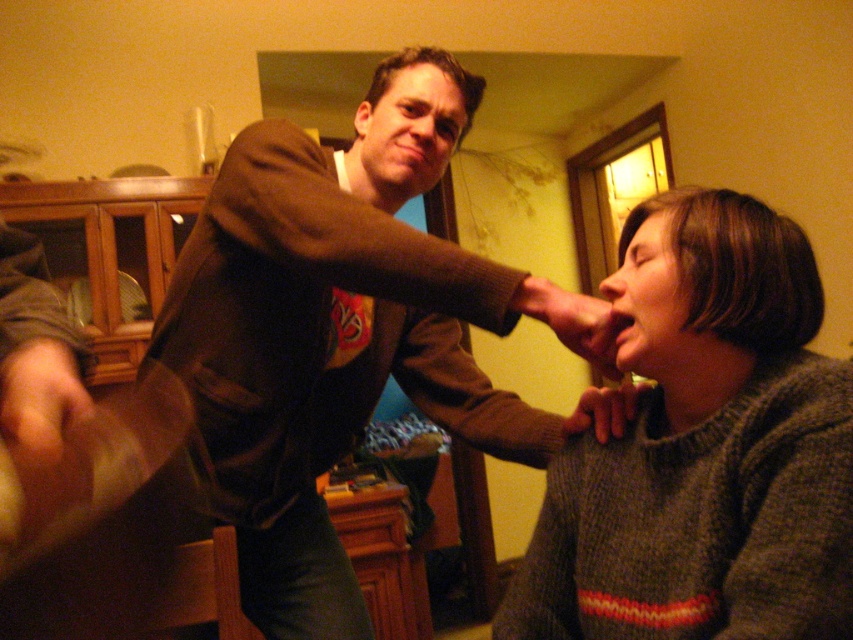
You are a tailor measuring a knitted gray sweater at lower right and a matte brown hand at upper center for a custom fit. Which object has a greater width?

The knitted gray sweater at lower right has a greater width than the matte brown hand at upper center.

You are a painter observing the scene and need to paint both the matte brown hand at upper center and the matte brown hand at lower right. Which hand should you paint larger in your artwork to accurately represent their sizes as seen in the image?

The matte brown hand at upper center should be painted larger than the matte brown hand at lower right because the matte brown hand at upper center is wider than the matte brown hand at lower right.

You are standing in the scene and want to touch the point at coordinates [573,321]. Which object from the list below would you need to reach towards? Choose from the objects listed below. Objects available to choose from are the man in brown jacket with graphic design on the front, the seated person in gray sweater with red and white stripes, the wooden cabinet with glass doors, and the doorway.

The point at coordinates [573,321] is located on the matte brown hand at upper center, which belongs to the man in brown jacket with graphic design on the front. Therefore, to touch that point, you would need to reach towards the man in brown jacket with graphic design on the front.